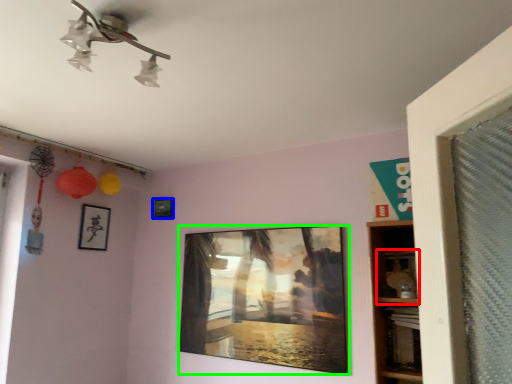
Question: Which object is the farthest from shelf (highlighted by a red box)? Choose among these: picture frame (highlighted by a blue box) or picture frame (highlighted by a green box).

Choices:
 (A) picture frame
 (B) picture frame

Answer: (A)